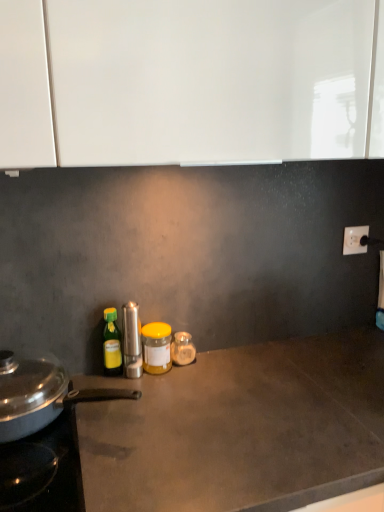
Question: Does yellow matte jar at center, which ranks as the second bottle in left-to-right order, lie behind satin silver pepper mill at center, the 2th kitchen appliance in the left-to-right sequence?

Choices:
 (A) no
 (B) yes

Answer: (B)

Question: Is yellow matte jar at center, which is the 2th bottle from right to left, positioned in front of satin silver pepper mill at center, the 1th kitchen appliance positioned from the right?

Choices:
 (A) no
 (B) yes

Answer: (A)

Question: Can we say yellow matte jar at center, which is the 2th bottle from right to left, lies outside satin silver pepper mill at center, the 2th kitchen appliance in the left-to-right sequence?

Choices:
 (A) yes
 (B) no

Answer: (A)

Question: From the image's perspective, is yellow matte jar at center, which ranks as the second bottle in left-to-right order, over satin silver pepper mill at center, the 2th kitchen appliance in the left-to-right sequence?

Choices:
 (A) yes
 (B) no

Answer: (B)

Question: Considering the relative positions of yellow matte jar at center, which is the 2th bottle from right to left, and satin silver pepper mill at center, the 2th kitchen appliance in the left-to-right sequence, in the image provided, is yellow matte jar at center, which is the 2th bottle from right to left, to the left of satin silver pepper mill at center, the 2th kitchen appliance in the left-to-right sequence, from the viewer's perspective?

Choices:
 (A) yes
 (B) no

Answer: (B)

Question: From a real-world perspective, relative to satin silver pepper mill at center, the 1th kitchen appliance positioned from the right, is metallic silver pan at left, the 2th kitchen appliance viewed from the right, vertically above or below?

Choices:
 (A) above
 (B) below

Answer: (B)

Question: Is metallic silver pan at left, which appears as the first kitchen appliance when viewed from the left, situated inside satin silver pepper mill at center, the 2th kitchen appliance in the left-to-right sequence, or outside?

Choices:
 (A) outside
 (B) inside

Answer: (A)

Question: Does point [x=8, y=373] appear closer or farther from the camera than point [x=135, y=309]?

Choices:
 (A) closer
 (B) farther

Answer: (A)

Question: In terms of width, does metallic silver pan at left, which appears as the first kitchen appliance when viewed from the left, look wider or thinner when compared to satin silver pepper mill at center, the 1th kitchen appliance positioned from the right?

Choices:
 (A) wide
 (B) thin

Answer: (A)

Question: Is point (228, 437) closer or farther from the camera than point (119, 343)?

Choices:
 (A) farther
 (B) closer

Answer: (B)

Question: From the image's perspective, is matte gray countertop at center above or below green plastic bottle at left, the 1th bottle viewed from the left?

Choices:
 (A) above
 (B) below

Answer: (B)

Question: Is matte gray countertop at center wider or thinner than green plastic bottle at left, the 1th bottle viewed from the left?

Choices:
 (A) wide
 (B) thin

Answer: (A)

Question: Is matte gray countertop at center in front of or behind green plastic bottle at left, the 1th bottle viewed from the left, in the image?

Choices:
 (A) front
 (B) behind

Answer: (A)

Question: Is green plastic bottle at left, the 3th bottle positioned from the right, inside or outside of metallic silver pan at left, which appears as the first kitchen appliance when viewed from the left?

Choices:
 (A) inside
 (B) outside

Answer: (A)

Question: Does point (119, 359) appear closer or farther from the camera than point (69, 396)?

Choices:
 (A) closer
 (B) farther

Answer: (B)